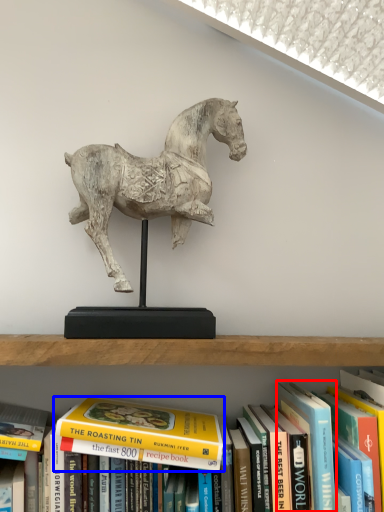
Question: Which object appears farthest to the camera in this image, paperback book (highlighted by a red box) or book (highlighted by a blue box)?

Choices:
 (A) paperback book
 (B) book

Answer: (B)